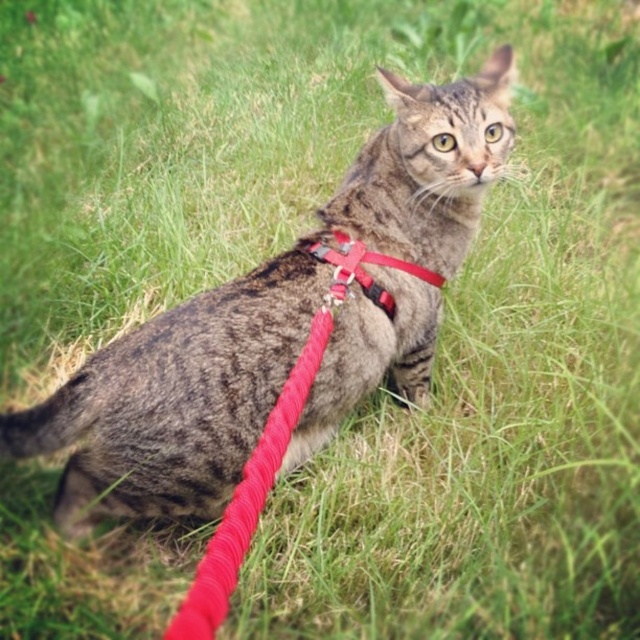
Question: Which point appears farthest from the camera in this image?

Choices:
 (A) (371, 257)
 (B) (147, 385)

Answer: (A)

Question: Is tabby fur cat at center smaller than matte red harness at center?

Choices:
 (A) yes
 (B) no

Answer: (B)

Question: Can you confirm if tabby fur cat at center is positioned to the right of matte red harness at center?

Choices:
 (A) yes
 (B) no

Answer: (B)

Question: Which of the following is the farthest from the observer?

Choices:
 (A) tabby fur cat at center
 (B) matte red harness at center

Answer: (B)

Question: Which point is closer to the camera?

Choices:
 (A) (497, 60)
 (B) (390, 307)

Answer: (B)

Question: Does tabby fur cat at center come in front of matte red harness at center?

Choices:
 (A) yes
 (B) no

Answer: (A)